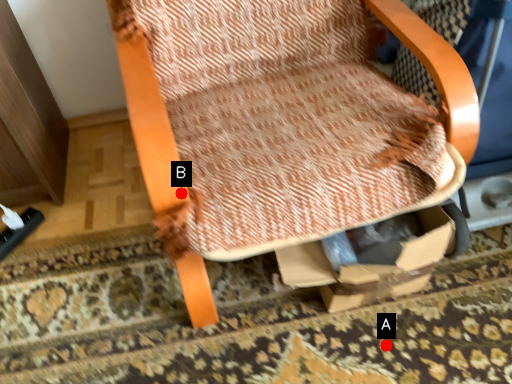
Question: Two points are circled on the image, labeled by A and B beside each circle. Which point is closer to the camera?

Choices:
 (A) A is closer
 (B) B is closer

Answer: (B)